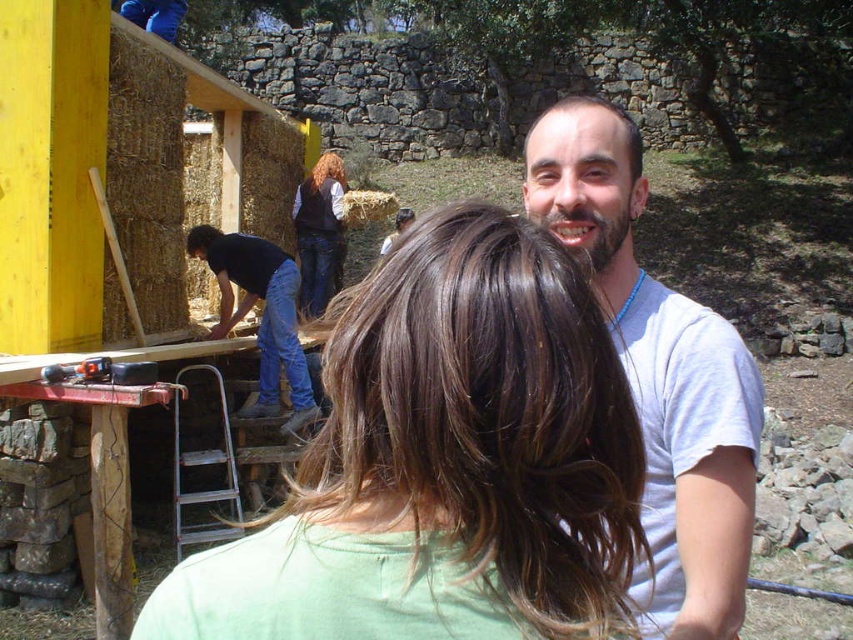
Question: In this image, where is white matte t-shirt at center located relative to denim jeans at center?

Choices:
 (A) left
 (B) right

Answer: (B)

Question: Considering the relative positions of white matte t-shirt at center and black plastic drill at lower left in the image provided, where is white matte t-shirt at center located with respect to black plastic drill at lower left?

Choices:
 (A) below
 (B) above

Answer: (B)

Question: Estimate the real-world distances between objects in this image. Which object is farther from the black plastic drill at lower left?

Choices:
 (A) denim jeans at center
 (B) brown hair at center

Answer: (A)

Question: Can you confirm if brown hair at center is positioned to the right of black plastic drill at lower left?

Choices:
 (A) no
 (B) yes

Answer: (B)

Question: Which object appears farthest from the camera in this image?

Choices:
 (A) brown hair at center
 (B) black plastic drill at lower left
 (C) denim jeans at center
 (D) blue jeans at left

Answer: (C)

Question: Which point appears closest to the camera in this image?

Choices:
 (A) (321, 202)
 (B) (105, 378)
 (C) (259, 259)

Answer: (B)